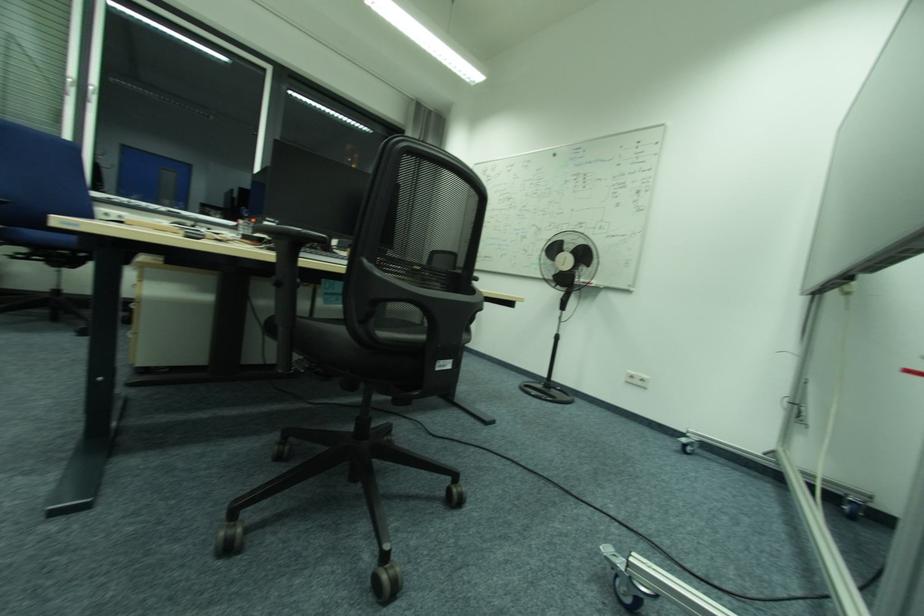
What do you see at coordinates (245, 222) in the screenshot? I see `a small transparent bottle` at bounding box center [245, 222].